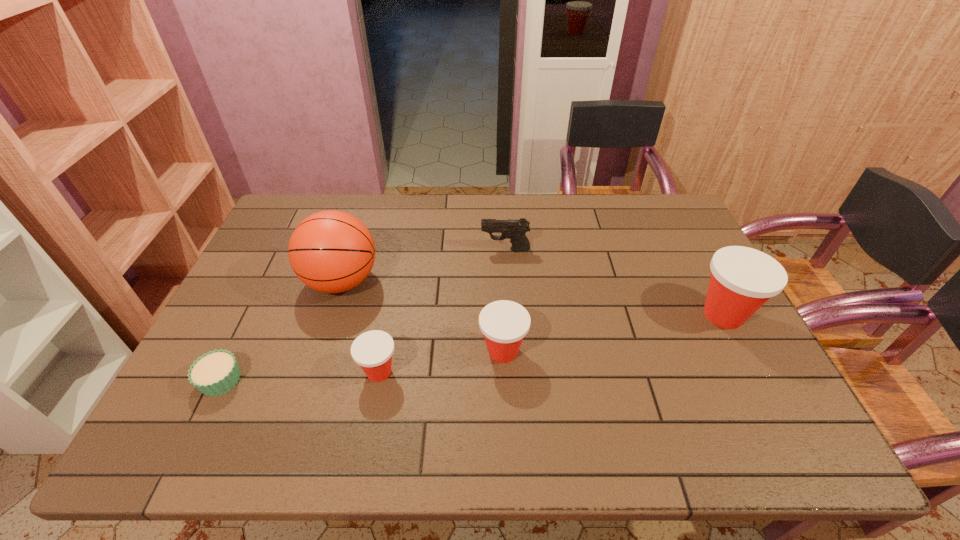
You are a GUI agent. You are given a task and a screenshot of the screen. Output one action in this format:
    pyautogui.click(x=<x>, y=<y>)
    Task: Click on the vacant position for inserting another Dixie_cup evenly
    The width and height of the screenshot is (960, 540).
    Given the screenshot: What is the action you would take?
    pyautogui.click(x=617, y=333)